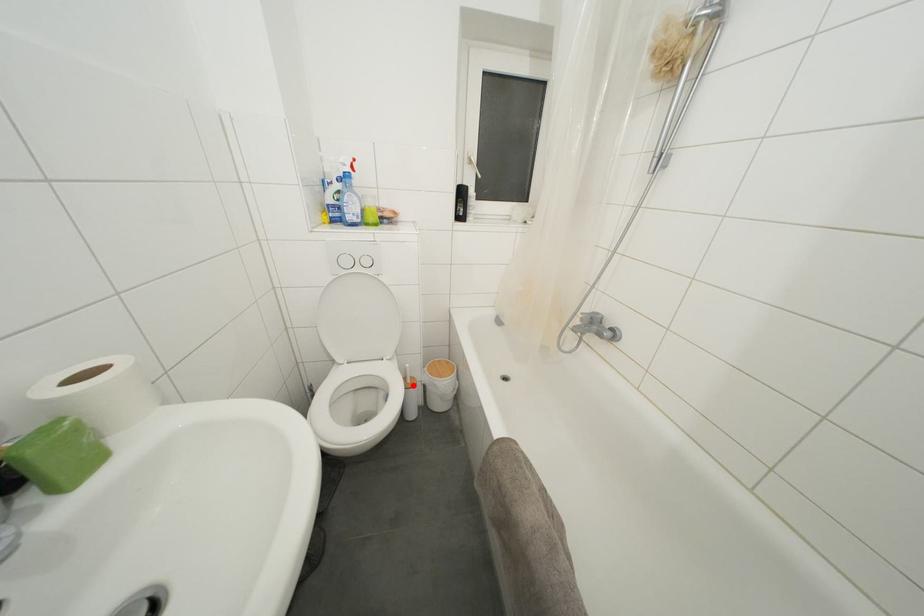
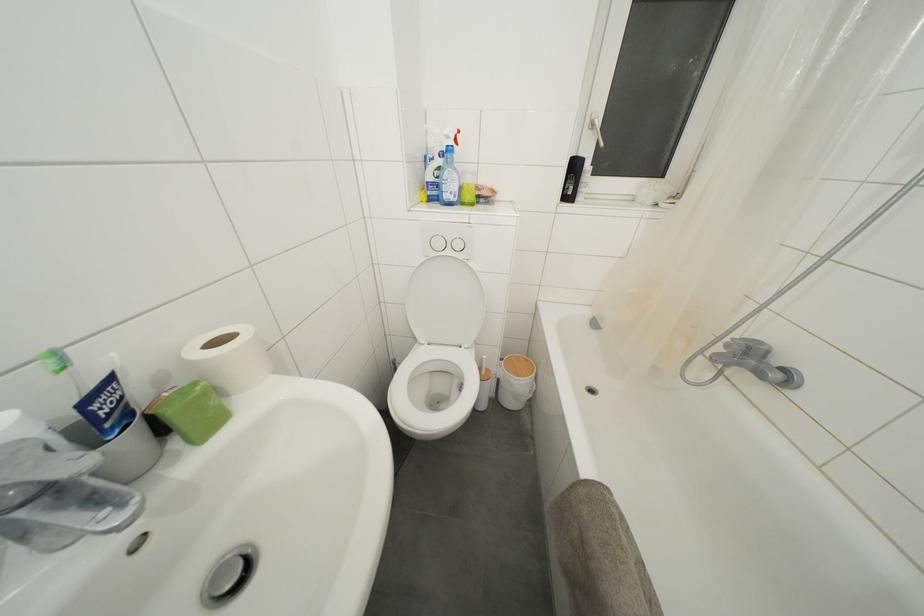
Where in the second image is the point corresponding to the highlighted location from the first image?

(488, 378)